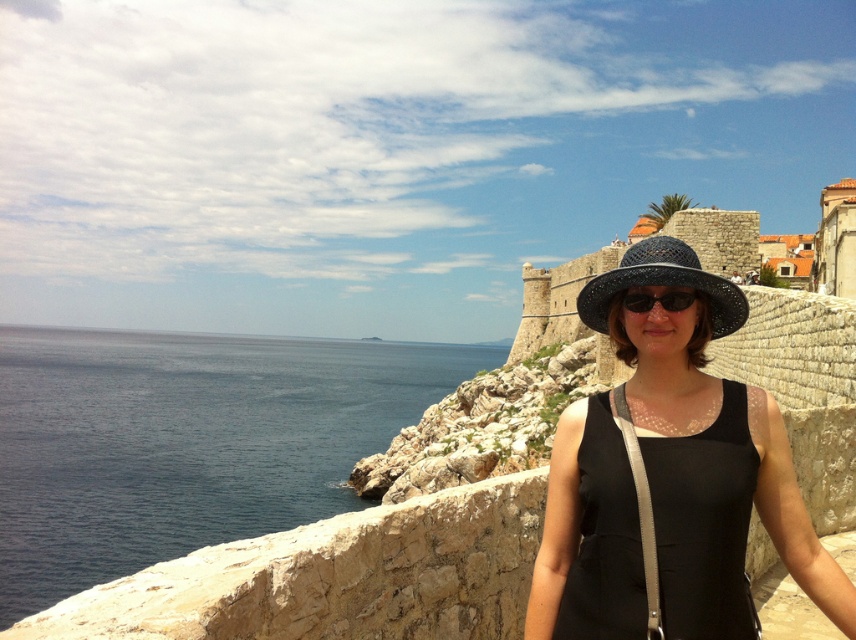
You are a photographer positioned at the point with coordinates point (711, 588). You want to take a photo of the historic fortification located at point (693, 284). Will the person standing on the stone wall block your view of the fortification?

Point (711, 588) is in front of point (693, 284), so the person standing on the stone wall at point (711, 588) will block your view of the fortification at point (693, 284).

Looking at this image, you are a photographer planning to take a wide shot of the coastal scene. The dark blue water at left and the blue woven hat at center are both in your frame. Which object will occupy more space in your photo?

The dark blue water at left is larger in size than the blue woven hat at center, so it will occupy more space in the photo.